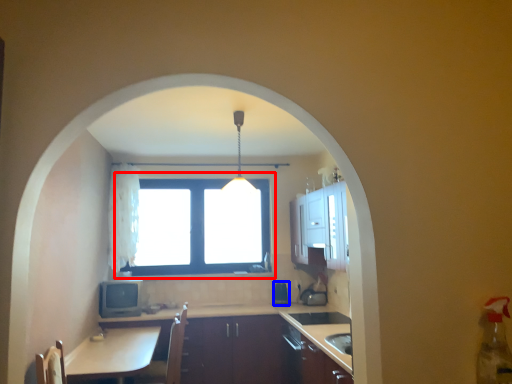
Question: Which of the following is the closest to the observer, window (highlighted by a red box) or appliance (highlighted by a blue box)?

Choices:
 (A) window
 (B) appliance

Answer: (B)